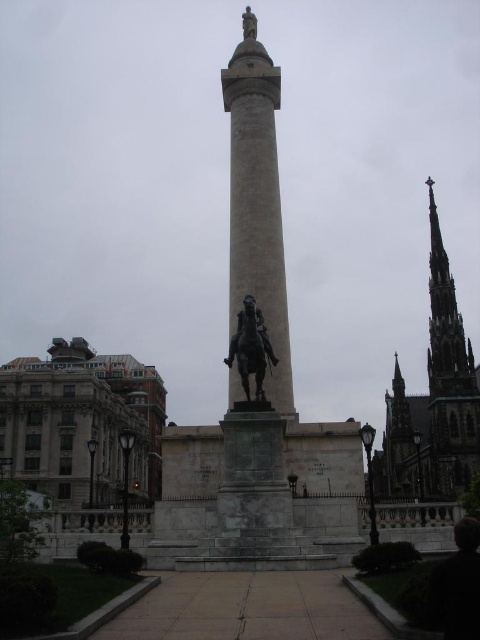
Does white marble column at center have a greater width compared to bronze statue at center?

Yes.

Is white marble column at center behind bronze statue at center?

Yes, white marble column at center is behind bronze statue at center.

Is point (244, 272) farther from viewer compared to point (250, 349)?

That is True.

Locate an element on the screen. This screenshot has height=640, width=480. white marble column at center is located at coordinates (256, 200).

The image size is (480, 640). What do you see at coordinates (433, 401) in the screenshot?
I see `dark gray stone spire at right` at bounding box center [433, 401].

Which is more to the right, dark gray stone spire at right or bronze statue at center?

Positioned to the right is dark gray stone spire at right.

Image resolution: width=480 pixels, height=640 pixels. What do you see at coordinates (433, 401) in the screenshot?
I see `dark gray stone spire at right` at bounding box center [433, 401].

Locate an element on the screen. This screenshot has width=480, height=640. dark gray stone spire at right is located at coordinates (433, 401).

How distant is white marble column at center from dark gray stone spire at right?

white marble column at center is 204.90 feet away from dark gray stone spire at right.

Who is shorter, white marble column at center or dark gray stone spire at right?

With less height is white marble column at center.

Between point (247, 28) and point (457, 433), which one is positioned in front?

Point (247, 28)

Where is `white marble column at center`? white marble column at center is located at coordinates coord(256,200).